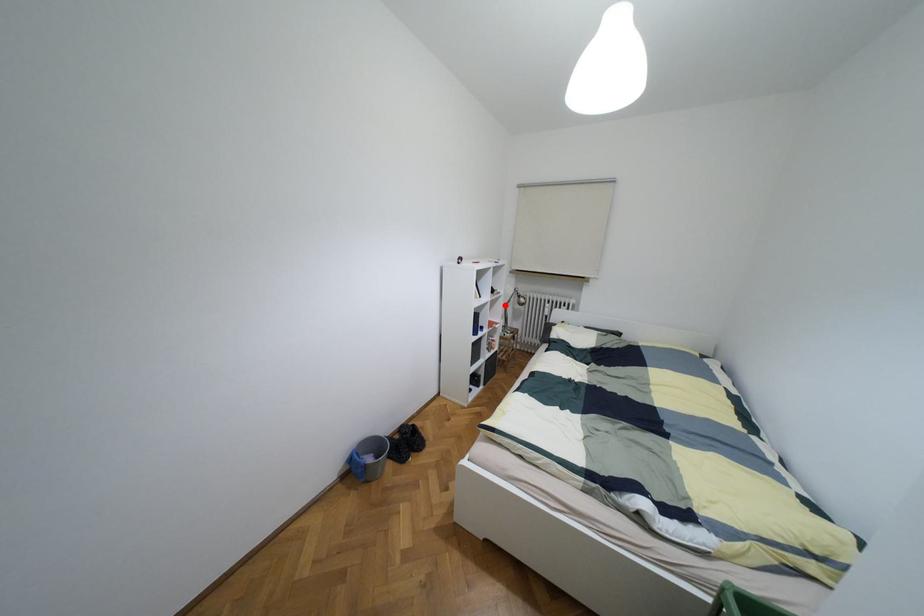
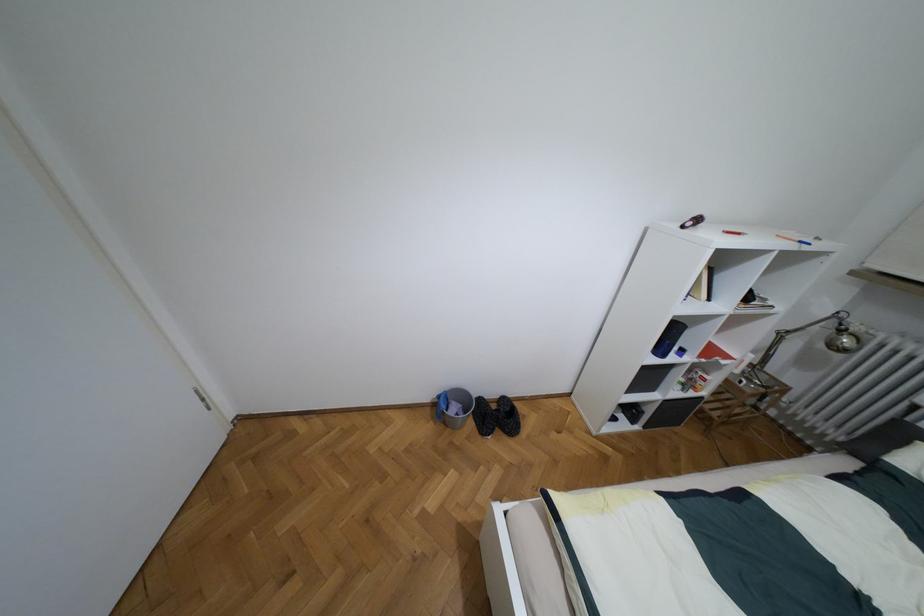
Find the pixel in the second image that matches the highlighted location in the first image.

(781, 334)